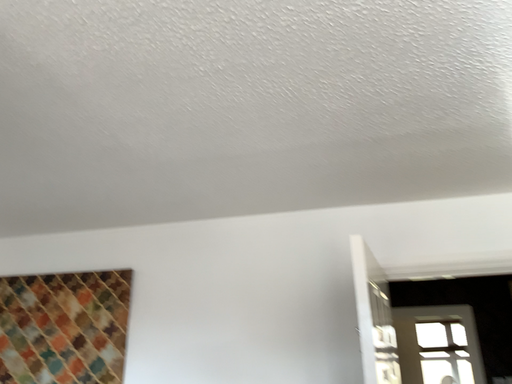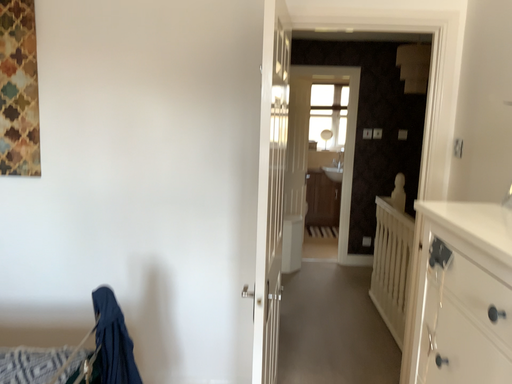
Question: How did the camera likely rotate when shooting the video?

Choices:
 (A) rotated left
 (B) rotated right

Answer: (B)